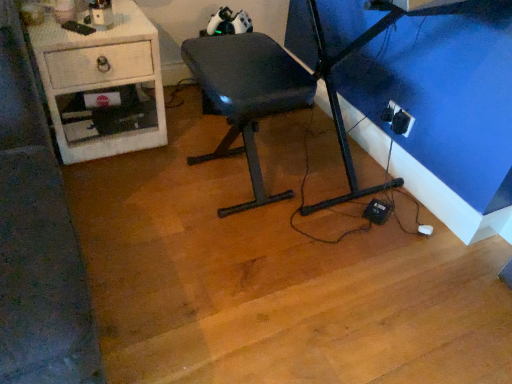
Question: Is matte black chair at center next to white glossy desk at left and touching it?

Choices:
 (A) yes
 (B) no

Answer: (B)

Question: From a real-world perspective, is matte black chair at center on top of white glossy desk at left?

Choices:
 (A) no
 (B) yes

Answer: (B)

Question: From a real-world perspective, is matte black chair at center physically below white glossy desk at left?

Choices:
 (A) yes
 (B) no

Answer: (B)

Question: Can you confirm if matte black chair at center is positioned to the right of white glossy desk at left?

Choices:
 (A) yes
 (B) no

Answer: (A)

Question: Is matte black chair at center taller than white glossy desk at left?

Choices:
 (A) no
 (B) yes

Answer: (B)

Question: Is matte black chair at center to the left or to the right of black plastic outlet at lower right in the image?

Choices:
 (A) left
 (B) right

Answer: (A)

Question: In terms of width, does matte black chair at center look wider or thinner when compared to black plastic outlet at lower right?

Choices:
 (A) wide
 (B) thin

Answer: (A)

Question: From the image's perspective, is matte black chair at center located above or below black plastic outlet at lower right?

Choices:
 (A) above
 (B) below

Answer: (B)

Question: From a real-world perspective, is matte black chair at center above or below black plastic outlet at lower right?

Choices:
 (A) below
 (B) above

Answer: (B)

Question: From their relative heights in the image, would you say white glossy desk at left is taller or shorter than matte black chair at center?

Choices:
 (A) short
 (B) tall

Answer: (A)

Question: From a real-world perspective, relative to matte black chair at center, is white glossy desk at left vertically above or below?

Choices:
 (A) above
 (B) below

Answer: (B)

Question: Is white glossy desk at left bigger or smaller than matte black chair at center?

Choices:
 (A) small
 (B) big

Answer: (B)

Question: Is white glossy desk at left spatially inside matte black chair at center, or outside of it?

Choices:
 (A) outside
 (B) inside

Answer: (A)

Question: Considering the positions of point tap(252, 94) and point tap(124, 26), is point tap(252, 94) closer or farther from the camera than point tap(124, 26)?

Choices:
 (A) farther
 (B) closer

Answer: (B)

Question: In the image, is matte black chair at center on the left side or the right side of white glossy desk at left?

Choices:
 (A) left
 (B) right

Answer: (B)